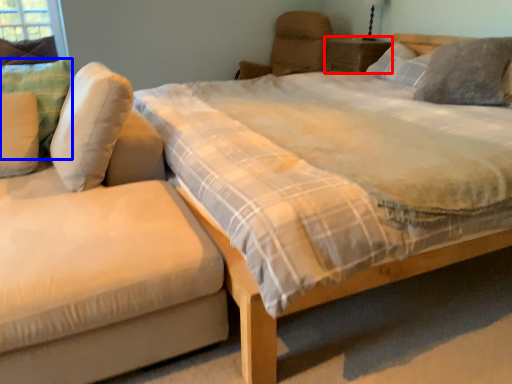
Question: Which object appears farthest to the camera in this image, nightstand (highlighted by a red box) or pillow (highlighted by a blue box)?

Choices:
 (A) nightstand
 (B) pillow

Answer: (A)